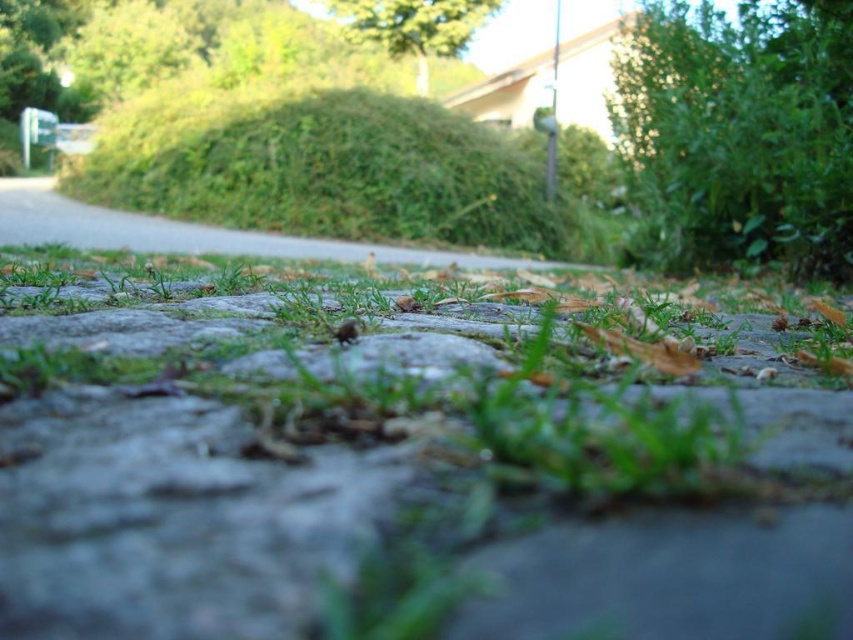
Question: Does green grass at center have a lesser width compared to green leafy grass at center?

Choices:
 (A) no
 (B) yes

Answer: (B)

Question: Which of the following is the farthest from the observer?

Choices:
 (A) (144, 449)
 (B) (207, 176)

Answer: (B)

Question: Where is green grass at center located in relation to green leafy grass at center in the image?

Choices:
 (A) below
 (B) above

Answer: (A)

Question: Which object appears farthest from the camera in this image?

Choices:
 (A) green grass at center
 (B) green leafy grass at center

Answer: (B)

Question: Can you confirm if green grass at center is positioned to the right of green leafy grass at center?

Choices:
 (A) yes
 (B) no

Answer: (A)

Question: Which object appears farthest from the camera in this image?

Choices:
 (A) green grass at center
 (B) green leafy grass at center

Answer: (B)